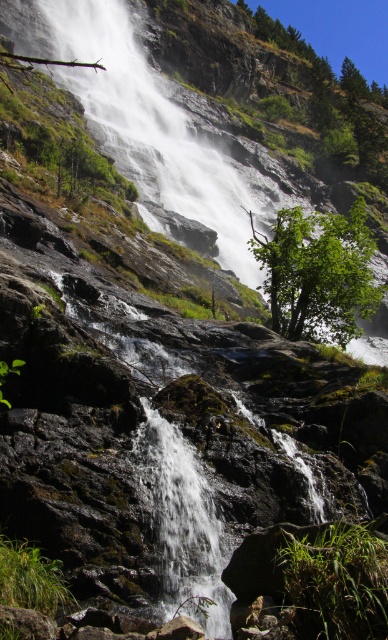
You are standing at the base of the cliff, looking up at the white smooth waterfall at center and the clear water at center. Which one is closer to you?

The clear water at center is behind the white smooth waterfall at center, so the white smooth waterfall at center is closer to you.

You are standing at the base of the cliff and want to determine which object is taller between the white smooth waterfall at center and the green leafy tree at center. Based on the scene, which one is taller?

The white smooth waterfall at center is taller than the green leafy tree at center according to the description.